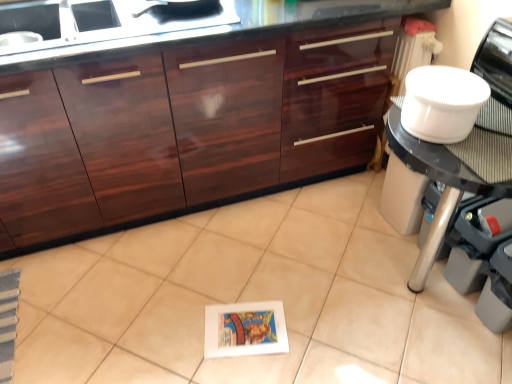
Locate an element on the screen. vacant location behind white paper book at center is located at coordinates (247, 279).